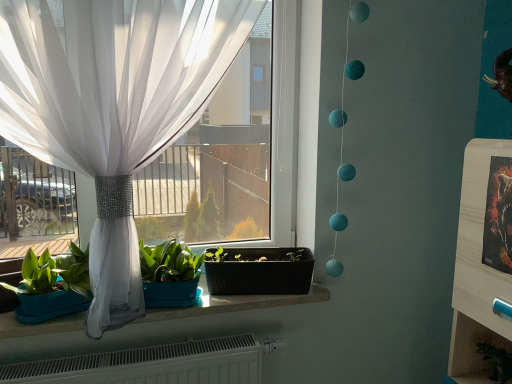
Question: Considering the relative sizes of metallic gold picture frame at right and black plastic flowerpot at center in the image provided, is metallic gold picture frame at right bigger than black plastic flowerpot at center?

Choices:
 (A) yes
 (B) no

Answer: (B)

Question: Is metallic gold picture frame at right turned away from black plastic flowerpot at center?

Choices:
 (A) no
 (B) yes

Answer: (A)

Question: Would you say black plastic flowerpot at center is part of metallic gold picture frame at right's contents?

Choices:
 (A) yes
 (B) no

Answer: (B)

Question: From the image's perspective, is metallic gold picture frame at right located beneath black plastic flowerpot at center?

Choices:
 (A) yes
 (B) no

Answer: (B)

Question: Does metallic gold picture frame at right appear on the left side of black plastic flowerpot at center?

Choices:
 (A) yes
 (B) no

Answer: (B)

Question: From the image's perspective, is matte white stone window sill at center positioned above or below white sheer curtain at left?

Choices:
 (A) above
 (B) below

Answer: (B)

Question: Considering the positions of point (313, 299) and point (71, 97), is point (313, 299) closer or farther from the camera than point (71, 97)?

Choices:
 (A) closer
 (B) farther

Answer: (B)

Question: Would you say matte white stone window sill at center is to the left or to the right of white sheer curtain at left in the picture?

Choices:
 (A) right
 (B) left

Answer: (B)

Question: From their relative heights in the image, would you say matte white stone window sill at center is taller or shorter than white sheer curtain at left?

Choices:
 (A) tall
 (B) short

Answer: (B)

Question: From a real-world perspective, is black plastic flowerpot at center physically located above or below matte white stone window sill at center?

Choices:
 (A) above
 (B) below

Answer: (A)

Question: Is point 305,276 closer or farther from the camera than point 322,301?

Choices:
 (A) closer
 (B) farther

Answer: (A)

Question: Looking at their shapes, would you say black plastic flowerpot at center is wider or thinner than matte white stone window sill at center?

Choices:
 (A) wide
 (B) thin

Answer: (B)

Question: Choose the correct answer: Is black plastic flowerpot at center inside matte white stone window sill at center or outside it?

Choices:
 (A) inside
 (B) outside

Answer: (B)

Question: Is point (476, 321) positioned closer to the camera than point (312, 259)?

Choices:
 (A) farther
 (B) closer

Answer: (B)

Question: From the image's perspective, is wooden shelf at lower right above or below black plastic flowerpot at center?

Choices:
 (A) below
 (B) above

Answer: (A)